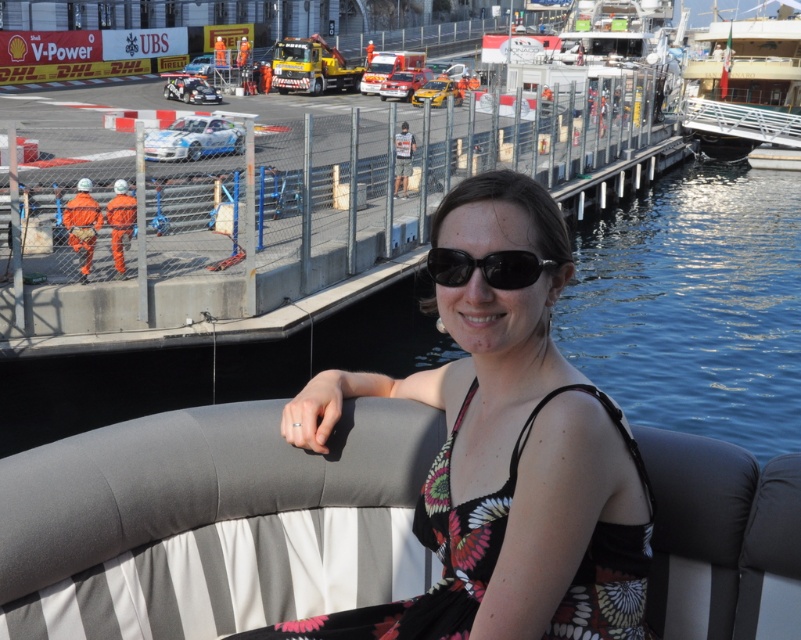
Question: Is white glossy yacht at upper right wider than white plastic boat at upper center?

Choices:
 (A) no
 (B) yes

Answer: (B)

Question: Can you confirm if black floral dress at center is bigger than white glossy yacht at upper right?

Choices:
 (A) no
 (B) yes

Answer: (A)

Question: Which of these objects is positioned farthest from the black plastic sunglasses at center?

Choices:
 (A) white plastic boat at upper center
 (B) black floral dress at center

Answer: (A)

Question: Among these objects, which one is nearest to the camera?

Choices:
 (A) black plastic sunglasses at center
 (B) white plastic boat at upper center
 (C) white glossy yacht at upper right
 (D) black floral dress at center

Answer: (D)

Question: Does white plastic boat at upper center have a greater width compared to black plastic sunglasses at center?

Choices:
 (A) no
 (B) yes

Answer: (B)

Question: Which point is closer to the camera?

Choices:
 (A) black plastic sunglasses at center
 (B) black floral dress at center
 (C) white plastic boat at upper center
 (D) white glossy yacht at upper right

Answer: (B)